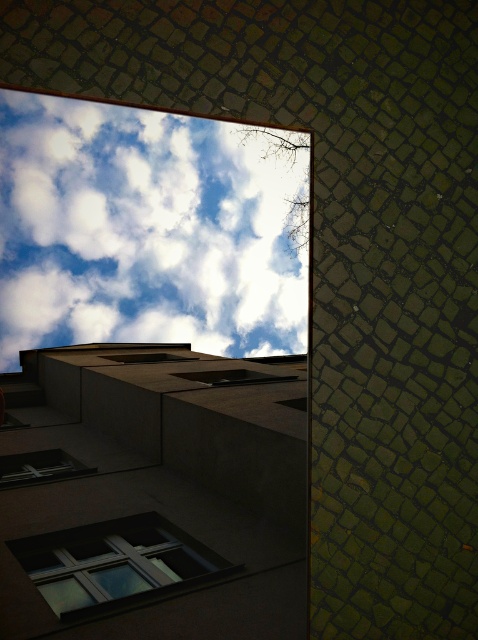
You are an architect designing a new building. You want to ensure that the white fluffy cloud at upper center is visible from the matte glass window at lower left. Based on their positions, is this possible?

The white fluffy cloud at upper center is located above the matte glass window at lower left, so yes, the cloud would be visible from the window as it is positioned above it.

You are standing in front of the modern building with a geometric design. You notice a transparent glass window at lower left. Can you determine its exact location using coordinates?

The transparent glass window at lower left is located at point (x=113, y=563).